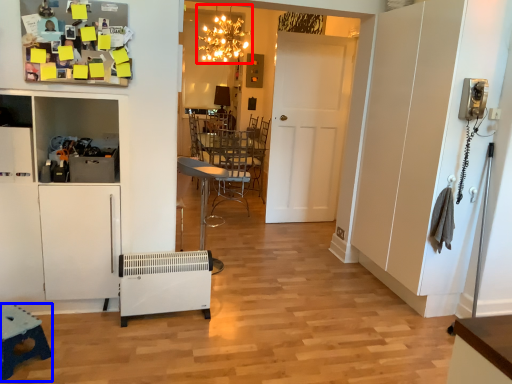
Question: Which of the following is the closest to the observer, light fixture (highlighted by a red box) or table (highlighted by a blue box)?

Choices:
 (A) light fixture
 (B) table

Answer: (B)